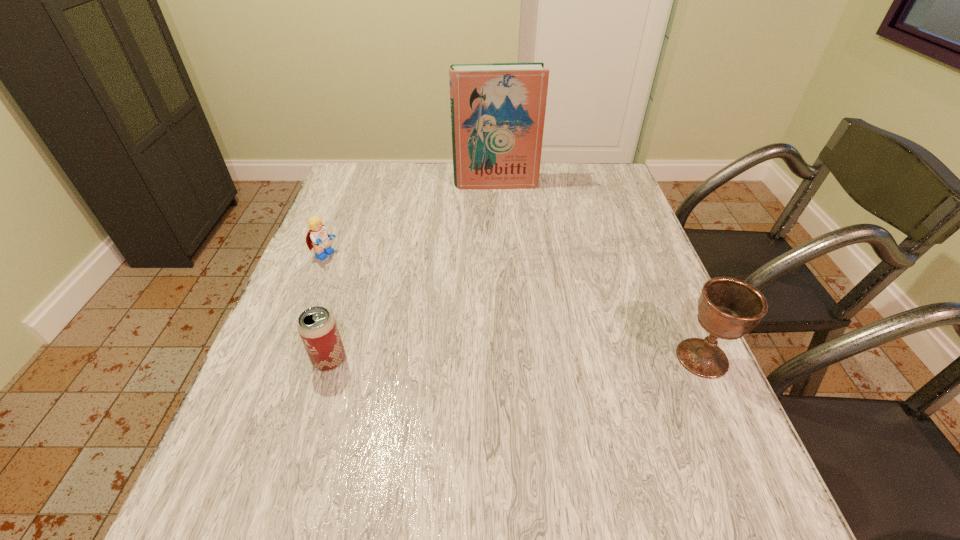
The width and height of the screenshot is (960, 540). What are the coordinates of `free space on the desktop that is between the third object from right to left and the third shortest object and is positioned on the cover of the farthest object` in the screenshot? It's located at (517, 359).

Where is `free space on the desktop that is between the beer can and the chalice and is positioned on the front-facing side of the leftmost object`? free space on the desktop that is between the beer can and the chalice and is positioned on the front-facing side of the leftmost object is located at coordinates (553, 359).